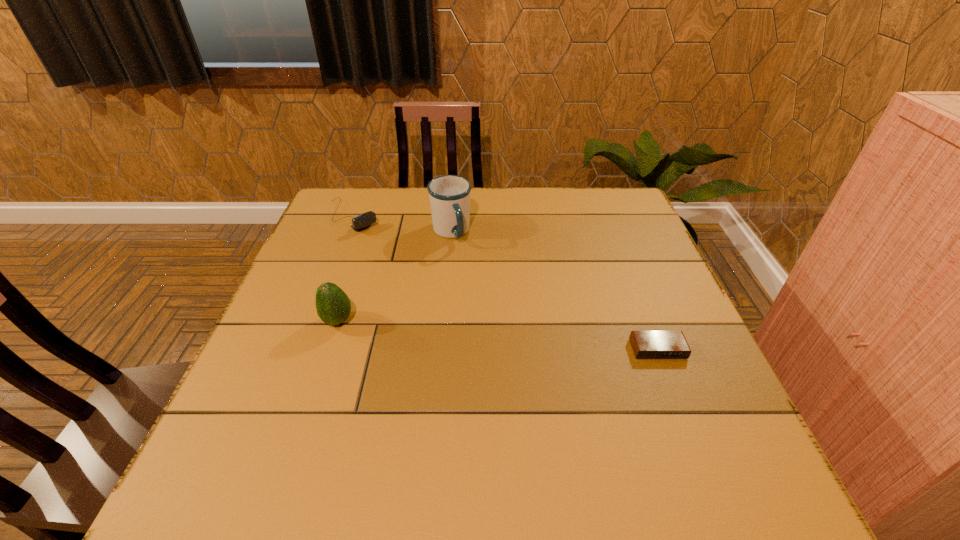
Where is `object at the far left corner`? The image size is (960, 540). object at the far left corner is located at coordinates (362, 221).

I want to click on vacant space at the far edge of the desktop, so click(x=486, y=222).

In order to click on vacant area at the left edge of the desktop in this screenshot , I will do `click(351, 244)`.

In the image, there is a desktop. Identify the location of vacant space at the right edge. (663, 381).

The image size is (960, 540). In order to click on vacant area at the far left corner of the desktop in this screenshot , I will do `click(370, 192)`.

Locate an element on the screen. This screenshot has width=960, height=540. vacant space at the near left corner is located at coordinates (279, 439).

The image size is (960, 540). Identify the location of vacant space at the far right corner of the desktop. (615, 229).

In order to click on vacant space that's between the avocado and the rightmost object in this screenshot , I will do `click(498, 335)`.

Locate an element on the screen. This screenshot has height=540, width=960. vacant area that lies between the third shortest object and the third object from left to right is located at coordinates (395, 277).

Locate an element on the screen. This screenshot has height=540, width=960. empty space that is in between the third shortest object and the mug is located at coordinates pyautogui.click(x=395, y=277).